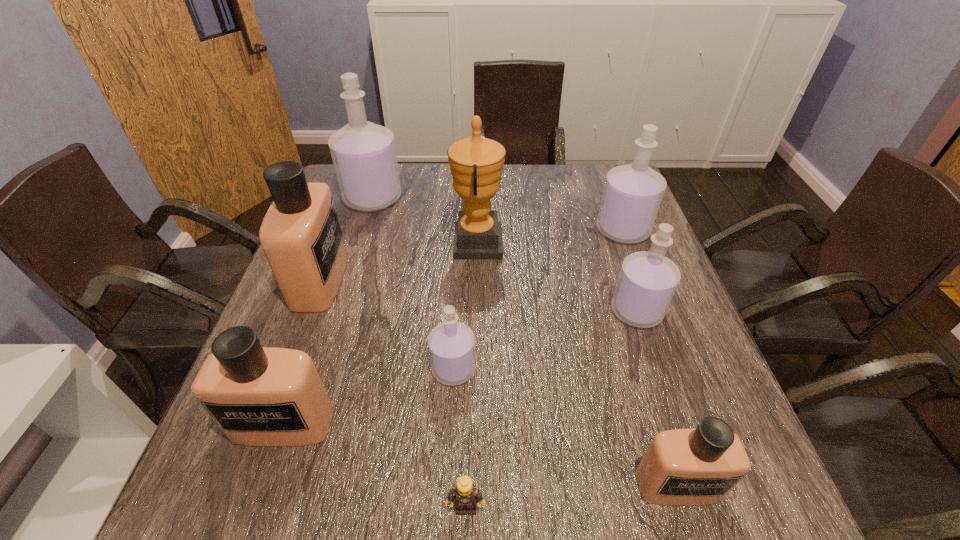
Locate an element on the screen. Image resolution: width=960 pixels, height=540 pixels. the smallest beige perfume is located at coordinates (682, 467).

Where is `the rightmost beige perfume`? The width and height of the screenshot is (960, 540). the rightmost beige perfume is located at coordinates click(x=682, y=467).

The width and height of the screenshot is (960, 540). Identify the location of Lego. (466, 496).

At what (x,y) coordinates should I click in order to perform the action: click on the shortest object. Please return your answer as a coordinate pair (x, y). The height and width of the screenshot is (540, 960). Looking at the image, I should click on (466, 496).

The height and width of the screenshot is (540, 960). I want to click on free region located 0.050m on the left of the tallest perfume, so click(x=327, y=198).

This screenshot has height=540, width=960. What are the coordinates of `blank area located 0.230m at the front of the golden award with handles` in the screenshot? It's located at (589, 244).

Where is `vacant space located on the front label of the farthest beige perfume`? vacant space located on the front label of the farthest beige perfume is located at coordinates (495, 280).

At what (x,y) coordinates should I click in order to perform the action: click on blank space located on the left of the second biggest purple perfume. Please return your answer as a coordinate pair (x, y). This screenshot has width=960, height=540. Looking at the image, I should click on (453, 230).

Identify the location of free space located on the front of the third farthest purple perfume. (662, 388).

Identify the location of vacant space located 0.090m on the front label of the second nearest perfume. (256, 502).